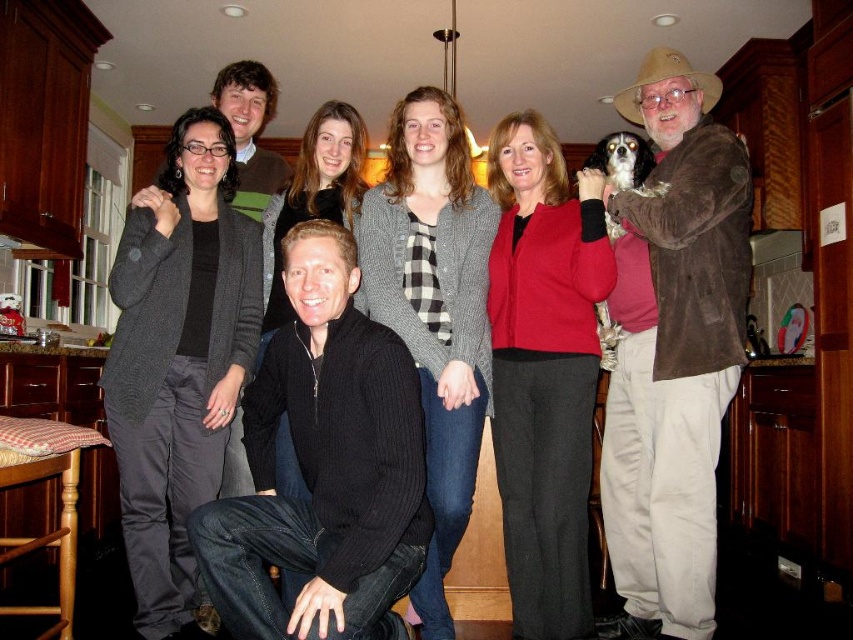
You are a photographer setting up for a group photo in a kitchen. You notice two people wearing different black sweaters. The first person is wearing a matte black sweater at center, and the second is wearing a black ribbed sweater at lower center. To ensure both sweaters are visible in the photo, which sweater should you adjust the lighting to highlight more?

The matte black sweater at center should be highlighted more because it is positioned above the black ribbed sweater at lower center, and might be in a brighter area due to its higher placement in the image.

From the picture: You are a photographer setting up for a group photo in a kitchen. You notice two people wearing a matte black sweater at center and a dark gray cardigan at center. Which clothing item is wider?

The matte black sweater at center is wider than the dark gray cardigan at center according to the description.